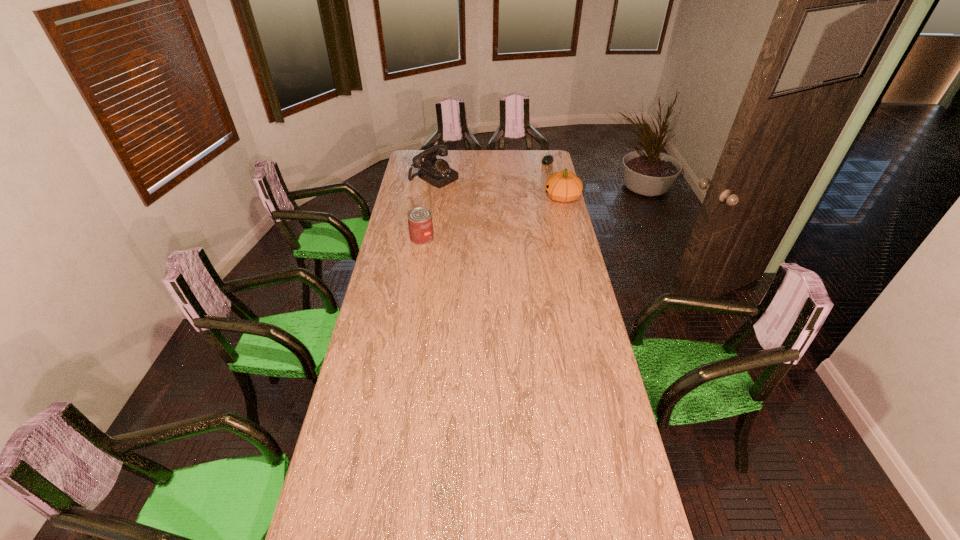
Identify the location of vacant region located on the wheel side of the shortest object. 525,192.

Image resolution: width=960 pixels, height=540 pixels. In order to click on vacant space positioned on the wheel side of the shortest object in this screenshot , I will do `click(523, 194)`.

Find the location of a particular element. vacant space situated 0.130m on the wheel side of the shortest object is located at coordinates [539, 175].

Find the location of a particular element. The height and width of the screenshot is (540, 960). vacant area located on the dial of the telephone is located at coordinates (468, 195).

At what (x,y) coordinates should I click in order to perform the action: click on free point located 0.130m on the dial of the telephone. Please return your answer as a coordinate pair (x, y). Image resolution: width=960 pixels, height=540 pixels. Looking at the image, I should click on click(x=467, y=194).

At what (x,y) coordinates should I click in order to perform the action: click on vacant position located on the dial of the telephone. Please return your answer as a coordinate pair (x, y). This screenshot has height=540, width=960. Looking at the image, I should click on (471, 197).

Where is `computer mouse present at the far edge`? The height and width of the screenshot is (540, 960). computer mouse present at the far edge is located at coordinates (547, 159).

The image size is (960, 540). Find the location of `telephone present at the far edge`. telephone present at the far edge is located at coordinates (436, 172).

Locate an element on the screen. The height and width of the screenshot is (540, 960). can located at the left edge is located at coordinates (420, 223).

I want to click on telephone positioned at the left edge, so click(436, 172).